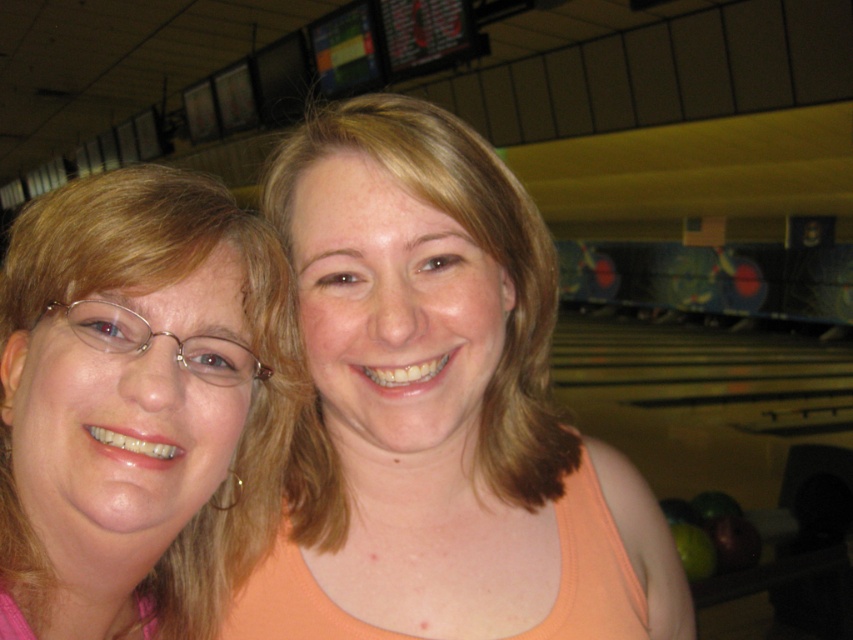
You are designing a new clothing display and need to know the spatial relationship between the matte peach tank top at center and the pink fabric at left. Which one has a greater width?

The matte peach tank top at center might be wider than pink fabric at left, so it could have a greater width.